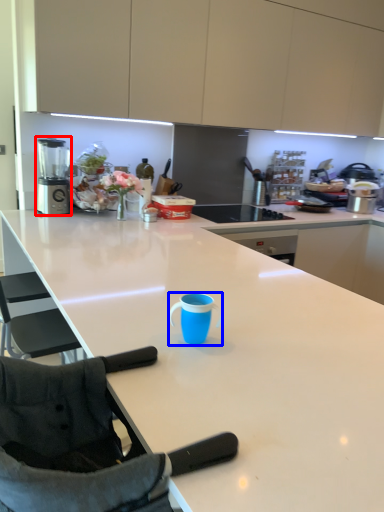
Question: Which of the following is the closest to the observer, blender (highlighted by a red box) or tableware (highlighted by a blue box)?

Choices:
 (A) blender
 (B) tableware

Answer: (B)